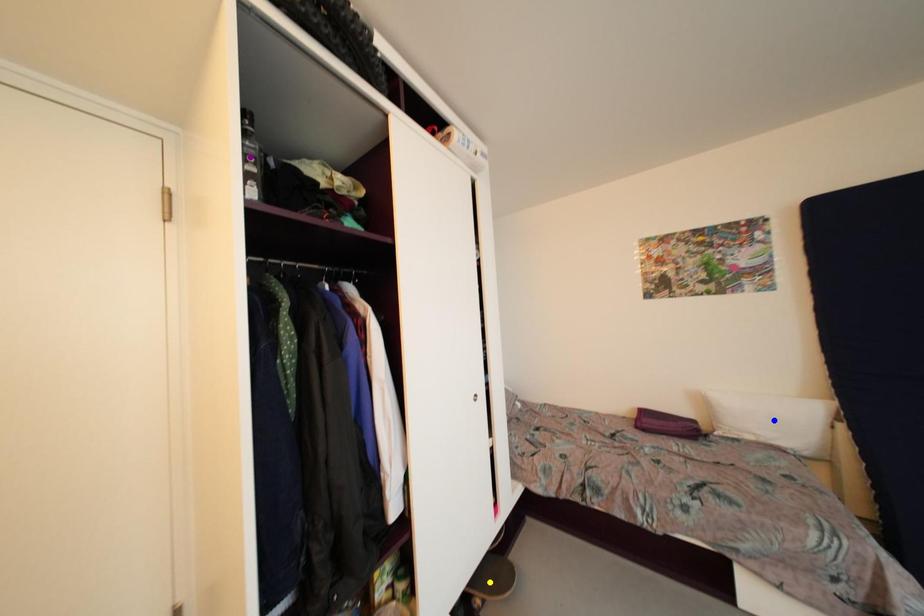
From the picture: Order these from nearest to farthest:
yellow point | purple point | blue point

purple point < yellow point < blue point